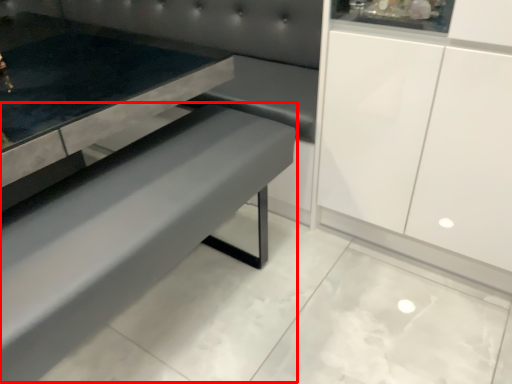
Question: Where is park bench (annotated by the red box) located in relation to couch in the image?

Choices:
 (A) right
 (B) left

Answer: (A)